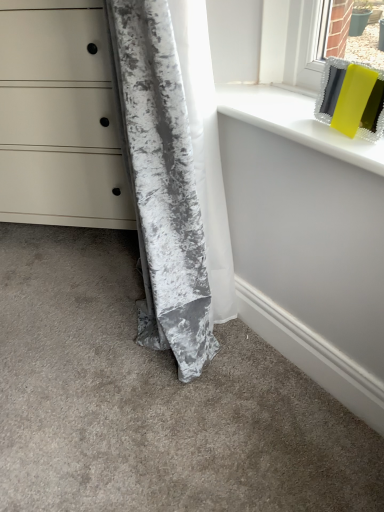
Question: Considering the relative sizes of matte white chest of drawers at lower left and white glossy window sill at upper right in the image provided, is matte white chest of drawers at lower left smaller than white glossy window sill at upper right?

Choices:
 (A) no
 (B) yes

Answer: (A)

Question: Is matte white chest of drawers at lower left positioned behind white glossy window sill at upper right?

Choices:
 (A) no
 (B) yes

Answer: (B)

Question: From a real-world perspective, is matte white chest of drawers at lower left located higher than white glossy window sill at upper right?

Choices:
 (A) no
 (B) yes

Answer: (A)

Question: From a real-world perspective, is matte white chest of drawers at lower left physically below white glossy window sill at upper right?

Choices:
 (A) yes
 (B) no

Answer: (A)

Question: Can you see matte white chest of drawers at lower left touching white glossy window sill at upper right?

Choices:
 (A) yes
 (B) no

Answer: (B)

Question: Considering the positions of point (367, 167) and point (16, 55), is point (367, 167) closer or farther from the camera than point (16, 55)?

Choices:
 (A) farther
 (B) closer

Answer: (B)

Question: In the image, is white glossy window sill at upper right on the left side or the right side of matte white chest of drawers at lower left?

Choices:
 (A) left
 (B) right

Answer: (B)

Question: Considering the positions of white glossy window sill at upper right and matte white chest of drawers at lower left in the image, is white glossy window sill at upper right bigger or smaller than matte white chest of drawers at lower left?

Choices:
 (A) big
 (B) small

Answer: (B)

Question: In terms of width, does white glossy window sill at upper right look wider or thinner when compared to matte white chest of drawers at lower left?

Choices:
 (A) thin
 (B) wide

Answer: (A)

Question: Considering the relative positions of crushed velvet curtain at lower left and white glossy window sill at upper right in the image provided, is crushed velvet curtain at lower left to the left or to the right of white glossy window sill at upper right?

Choices:
 (A) left
 (B) right

Answer: (A)

Question: From the image's perspective, is crushed velvet curtain at lower left positioned above or below white glossy window sill at upper right?

Choices:
 (A) above
 (B) below

Answer: (B)

Question: Considering their positions, is crushed velvet curtain at lower left located in front of or behind white glossy window sill at upper right?

Choices:
 (A) front
 (B) behind

Answer: (A)

Question: Is crushed velvet curtain at lower left inside or outside of white glossy window sill at upper right?

Choices:
 (A) inside
 (B) outside

Answer: (B)

Question: From a real-world perspective, is white glossy window sill at upper right physically located above or below crushed velvet curtain at lower left?

Choices:
 (A) above
 (B) below

Answer: (A)

Question: Would you say white glossy window sill at upper right is to the left or to the right of crushed velvet curtain at lower left in the picture?

Choices:
 (A) left
 (B) right

Answer: (B)